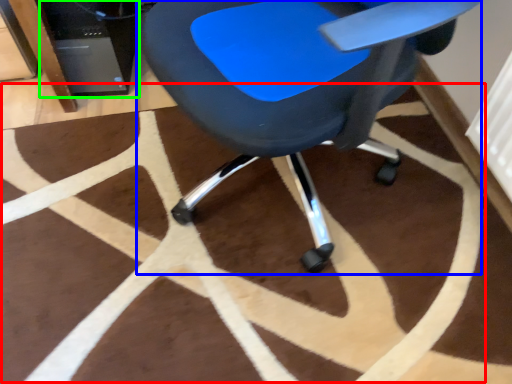
Question: Which object is positioned closest to mat (highlighted by a red box)? Select from chair (highlighted by a blue box) and computer tower (highlighted by a green box).

Choices:
 (A) chair
 (B) computer tower

Answer: (A)